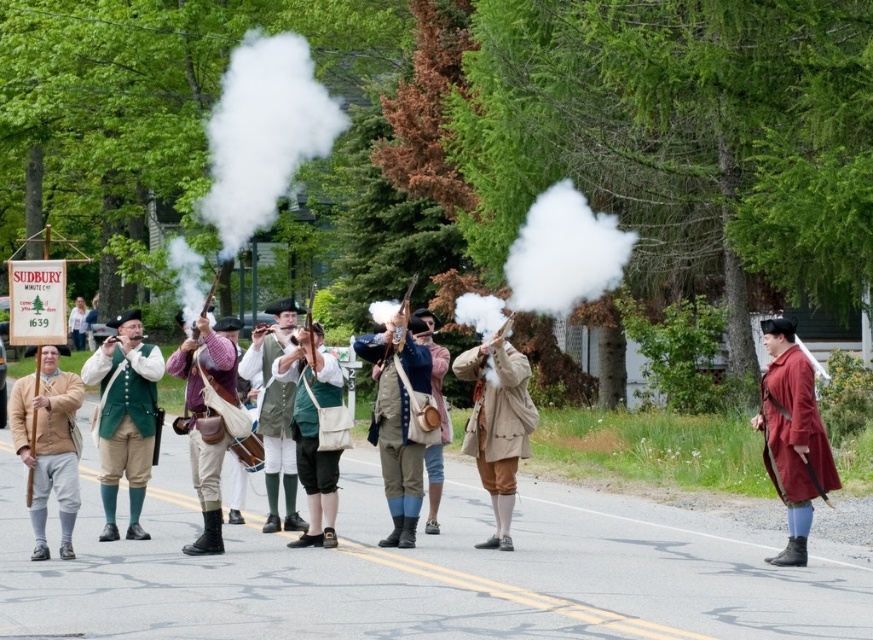
Question: Among these points, which one is farthest from the camera?

Choices:
 (A) (568, 273)
 (B) (796, 524)

Answer: (A)

Question: Which point is closer to the camera?

Choices:
 (A) (780, 472)
 (B) (63, 516)
 (C) (376, 396)
 (D) (275, 48)

Answer: (B)

Question: Does maroon wool coat at center appear over light brown leather coat at center?

Choices:
 (A) yes
 (B) no

Answer: (B)

Question: Is white smoke at center to the right of light brown leather jacket at center from the viewer's perspective?

Choices:
 (A) yes
 (B) no

Answer: (A)

Question: Which point is closer to the camera taking this photo?

Choices:
 (A) (359, 342)
 (B) (80, 340)
 (C) (275, 417)
 (D) (791, 321)

Answer: (D)

Question: Does light brown leather stick at center appear under knitted wool sweater at center?

Choices:
 (A) yes
 (B) no

Answer: (A)